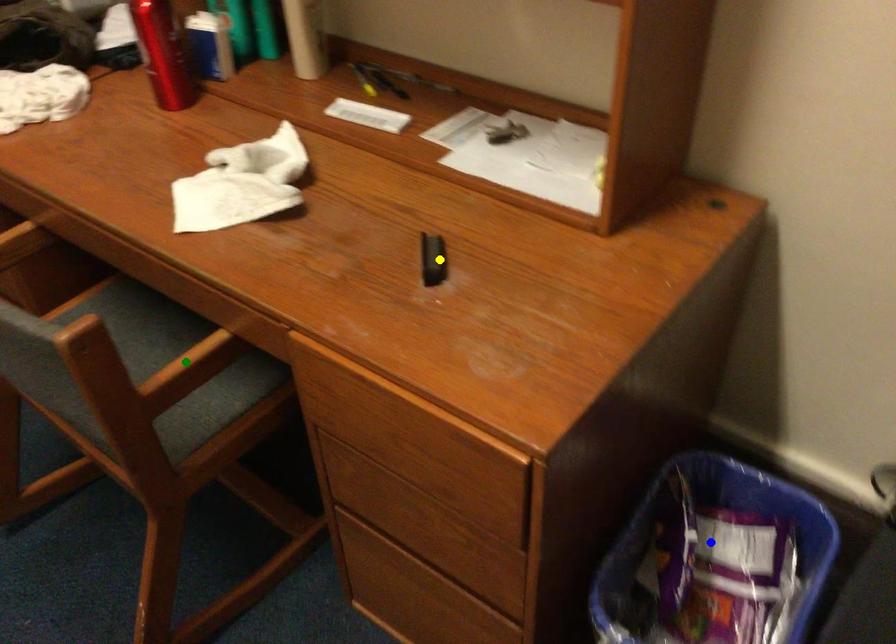
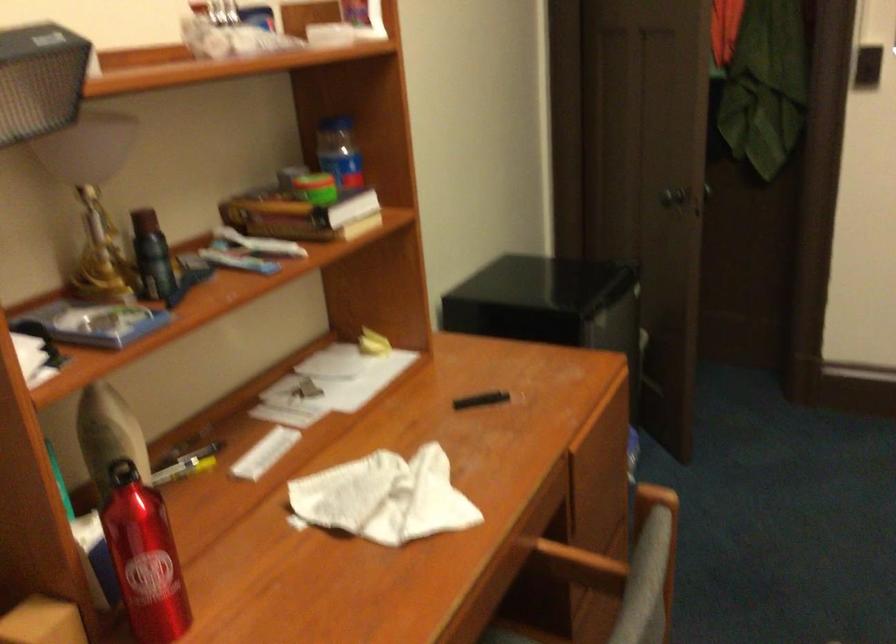
I am providing you with two images of the same scene from different viewpoints. Three points are marked in image1. Which point corresponds to a part or object that is occluded in image2?In image1, three points are marked. Which of them correspond to a part or object that is occluded in image2?Among the three points shown in image1, which one corresponds to a part or object that is no longer visible due to occlusion in image2?

blue point